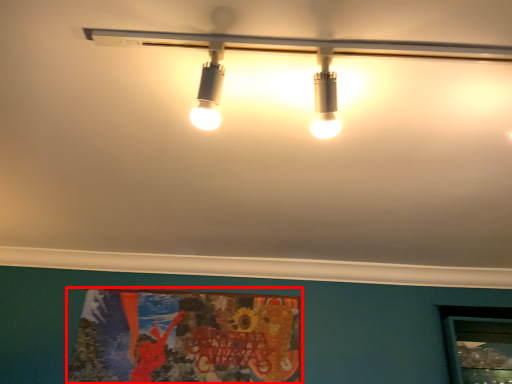
Question: From the image, what is the correct spatial relationship of poster page (annotated by the red box) in relation to lamp?

Choices:
 (A) right
 (B) left

Answer: (B)